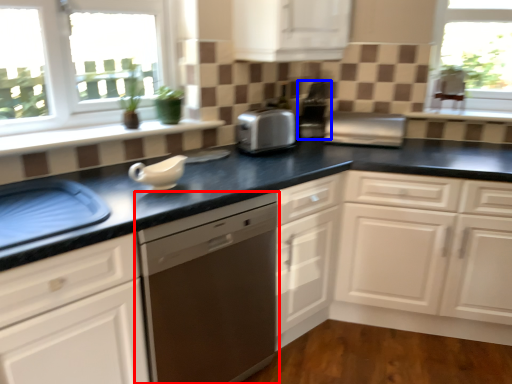
Question: Which point is closer to the camera, dishwasher (highlighted by a red box) or coffee machine (highlighted by a blue box)?

Choices:
 (A) dishwasher
 (B) coffee machine

Answer: (A)